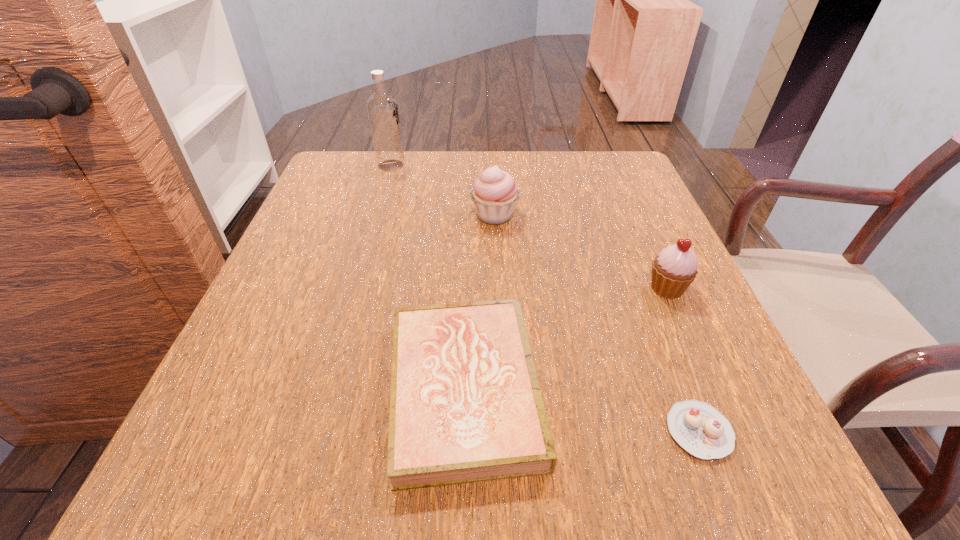
The width and height of the screenshot is (960, 540). I want to click on vacant region between the third nearest object and the nearest cupcake, so click(x=683, y=360).

Where is `vacant region between the second shortest object and the tallest object`? Image resolution: width=960 pixels, height=540 pixels. vacant region between the second shortest object and the tallest object is located at coordinates (428, 277).

Identify the location of free space between the leftmost object and the second nearest cupcake. Image resolution: width=960 pixels, height=540 pixels. (529, 227).

Where is `free space between the shortest cupcake and the vodka`? The image size is (960, 540). free space between the shortest cupcake and the vodka is located at coordinates (544, 298).

Locate an element on the screen. the fourth closest object to the vodka is located at coordinates (700, 429).

Choose which object is the nearest neighbor to the leftmost cupcake. Please provide its 2D coordinates. Your answer should be formatted as a tuple, i.e. [(x, y)], where the tuple contains the x and y coordinates of a point satisfying the conditions above.

[(382, 108)]

This screenshot has height=540, width=960. I want to click on cupcake that is the second nearest to the leftmost object, so click(x=675, y=268).

Identify which cupcake is the second nearest to the nearest cupcake. Please provide its 2D coordinates. Your answer should be formatted as a tuple, i.e. [(x, y)], where the tuple contains the x and y coordinates of a point satisfying the conditions above.

[(495, 193)]

At what (x,y) coordinates should I click in order to perform the action: click on vacant point that satisfies the following two spatial constraints: 1. on the front label of the tallest object; 2. on the left side of the nearest cupcake. Please return your answer as a coordinate pair (x, y). Looking at the image, I should click on (312, 431).

This screenshot has height=540, width=960. I want to click on vacant area that satisfies the following two spatial constraints: 1. on the back side of the shortest object; 2. on the front label of the leftmost object, so click(596, 165).